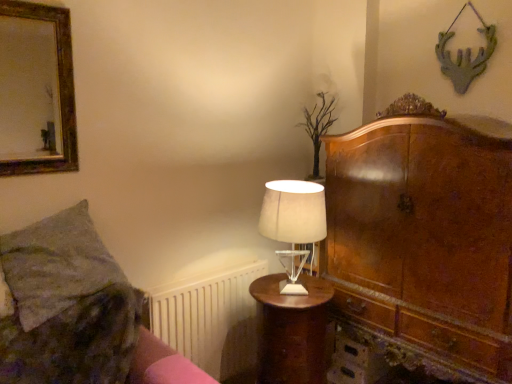
In order to click on translucent glass table lamp at center in this screenshot , I will do `click(293, 223)`.

Image resolution: width=512 pixels, height=384 pixels. What do you see at coordinates (36, 90) in the screenshot?
I see `gold-framed mirror at upper left` at bounding box center [36, 90].

The image size is (512, 384). I want to click on mahogany wood nightstand at center, so click(291, 330).

Choose the correct answer: Is pink fabric bed frame at lower left inside white plastic radiator at lower left or outside it?

pink fabric bed frame at lower left exists outside the volume of white plastic radiator at lower left.

Is pink fabric bed frame at lower left bigger than white plastic radiator at lower left?

Incorrect, pink fabric bed frame at lower left is not larger than white plastic radiator at lower left.

Locate an element on the screen. This screenshot has width=512, height=384. radiator located below the pink fabric bed frame at lower left (from the image's perspective) is located at coordinates (210, 318).

From a real-world perspective, relative to white plastic radiator at lower left, is pink fabric bed frame at lower left vertically above or below?

From a real-world perspective, pink fabric bed frame at lower left is physically above white plastic radiator at lower left.

Between point (300, 310) and point (37, 233), which one is positioned behind?

Point (300, 310)

Is mahogany wood nightstand at center surrounding green textured pillow at left?

No, green textured pillow at left is not inside mahogany wood nightstand at center.

Measure the distance from mahogany wood nightstand at center to green textured pillow at left.

mahogany wood nightstand at center and green textured pillow at left are 32.92 inches apart from each other.

Can you tell me how much mahogany wood nightstand at center and green textured pillow at left differ in facing direction?

0.412 degrees.

Looking at this image, what's the angular difference between green textured pillow at left and white plastic radiator at lower left's facing directions?

0.918 degrees separate the facing orientations of green textured pillow at left and white plastic radiator at lower left.

From the image's perspective, is green textured pillow at left positioned above or below white plastic radiator at lower left?

green textured pillow at left is above white plastic radiator at lower left.

Is green textured pillow at left surrounding white plastic radiator at lower left?

No, white plastic radiator at lower left is located outside of green textured pillow at left.

Considering the sizes of objects green textured pillow at left and white plastic radiator at lower left in the image provided, who is taller, green textured pillow at left or white plastic radiator at lower left?

white plastic radiator at lower left.

In the scene shown: Considering their positions, is translucent glass table lamp at center located in front of or behind mahogany wood nightstand at center?

Visually, translucent glass table lamp at center is located in front of mahogany wood nightstand at center.

Which is in front, point (305, 200) or point (320, 363)?

Point (305, 200)

Is mahogany wood nightstand at center at the back of translucent glass table lamp at center?

translucent glass table lamp at center is not turned away from mahogany wood nightstand at center.

Looking at the image, does translucent glass table lamp at center seem bigger or smaller compared to mahogany wood nightstand at center?

Clearly, translucent glass table lamp at center is smaller in size than mahogany wood nightstand at center.

Locate an element on the screen. The height and width of the screenshot is (384, 512). pillow above the translucent glass table lamp at center (from a real-world perspective) is located at coordinates click(x=56, y=264).

How distant is green textured pillow at left from translucent glass table lamp at center?

green textured pillow at left is 31.70 inches from translucent glass table lamp at center.

Is point (26, 233) more distant than point (273, 230)?

No, (26, 233) is closer to viewer.

How different are the orientations of green textured pillow at left and translucent glass table lamp at center in degrees?

There is a 1.09-degree angle between the facing directions of green textured pillow at left and translucent glass table lamp at center.

Is pink fabric bed frame at lower left surrounded by translucent glass table lamp at center?

No, pink fabric bed frame at lower left is not inside translucent glass table lamp at center.

Does point (272, 237) come farther from viewer compared to point (150, 364)?

Yes, point (272, 237) is behind point (150, 364).

Is translucent glass table lamp at center aimed at pink fabric bed frame at lower left?

No, translucent glass table lamp at center is not turned towards pink fabric bed frame at lower left.

Is translucent glass table lamp at center next to pink fabric bed frame at lower left?

No, translucent glass table lamp at center is not beside pink fabric bed frame at lower left.

From a real-world perspective, relative to translucent glass table lamp at center, is pink fabric bed frame at lower left vertically above or below?

Clearly, from a real-world perspective, pink fabric bed frame at lower left is below translucent glass table lamp at center.

Is pink fabric bed frame at lower left surrounding translucent glass table lamp at center?

That's incorrect, translucent glass table lamp at center is not inside pink fabric bed frame at lower left.

From the image's perspective, is pink fabric bed frame at lower left under translucent glass table lamp at center?

Correct, pink fabric bed frame at lower left appears lower than translucent glass table lamp at center in the image.

Find the location of a particular element. Image resolution: width=512 pixels, height=384 pixels. radiator below the pink fabric bed frame at lower left (from the image's perspective) is located at coordinates (210, 318).

This screenshot has width=512, height=384. I want to click on nightstand that is on the right side of green textured pillow at left, so pyautogui.click(x=291, y=330).

When comparing their distances from white plastic radiator at lower left, does green textured pillow at left or mahogany wood nightstand at center seem closer?

mahogany wood nightstand at center is closer to white plastic radiator at lower left.

Which object lies further to the anchor point green textured pillow at left, pink fabric bed frame at lower left or gold-framed mirror at upper left?

Based on the image, gold-framed mirror at upper left appears to be further to green textured pillow at left.

When comparing their distances from pink fabric bed frame at lower left, does green textured pillow at left or translucent glass table lamp at center seem closer?

green textured pillow at left is positioned closer to the anchor pink fabric bed frame at lower left.

Estimate the real-world distances between objects in this image. Which object is further from gold-framed mirror at upper left, translucent glass table lamp at center or green textured pillow at left?

translucent glass table lamp at center.

Which object lies nearer to the anchor point green textured pillow at left, pink fabric bed frame at lower left or white plastic radiator at lower left?

pink fabric bed frame at lower left.

Looking at the image, which one is located closer to green textured pillow at left, translucent glass table lamp at center or pink fabric bed frame at lower left?

pink fabric bed frame at lower left is closer to green textured pillow at left.

Which object lies nearer to the anchor point green textured pillow at left, translucent glass table lamp at center or mahogany wood nightstand at center?

Based on the image, translucent glass table lamp at center appears to be nearer to green textured pillow at left.

Based on their spatial positions, is gold-framed mirror at upper left or translucent glass table lamp at center further from mahogany wood nightstand at center?

gold-framed mirror at upper left is further to mahogany wood nightstand at center.

Where is `nightstand between pink fabric bed frame at lower left and white plastic radiator at lower left in the front-back direction`? The width and height of the screenshot is (512, 384). nightstand between pink fabric bed frame at lower left and white plastic radiator at lower left in the front-back direction is located at coordinates (291, 330).

I want to click on radiator between gold-framed mirror at upper left and mahogany wood nightstand at center in the up-down direction, so click(x=210, y=318).

Where is `table lamp between gold-framed mirror at upper left and pink fabric bed frame at lower left in the vertical direction`? table lamp between gold-framed mirror at upper left and pink fabric bed frame at lower left in the vertical direction is located at coordinates (293, 223).

Identify the location of pillow between gold-framed mirror at upper left and mahogany wood nightstand at center in the up-down direction. (56, 264).